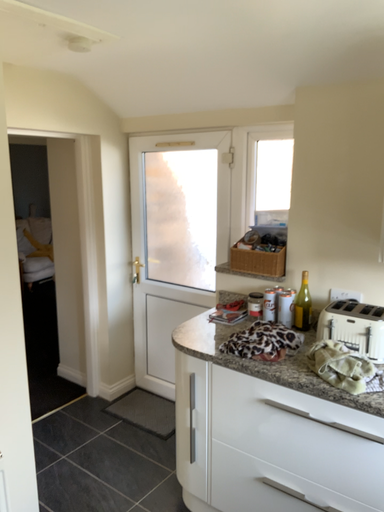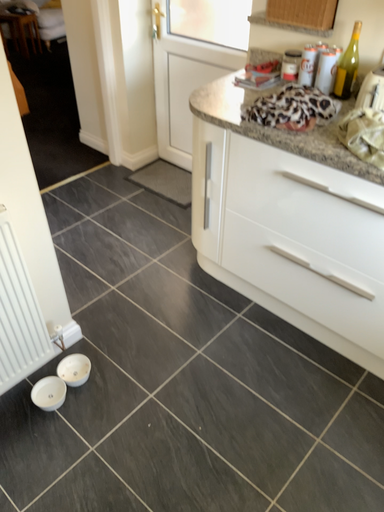
Question: Which way did the camera rotate in the video?

Choices:
 (A) rotated upward
 (B) rotated downward

Answer: (B)